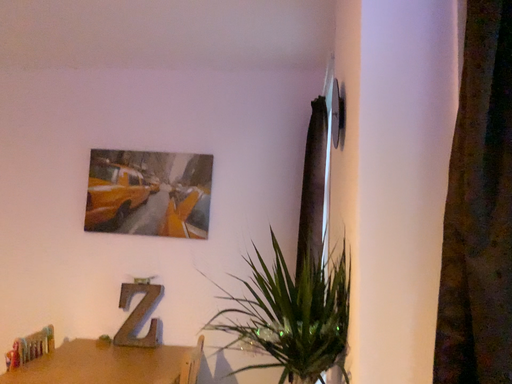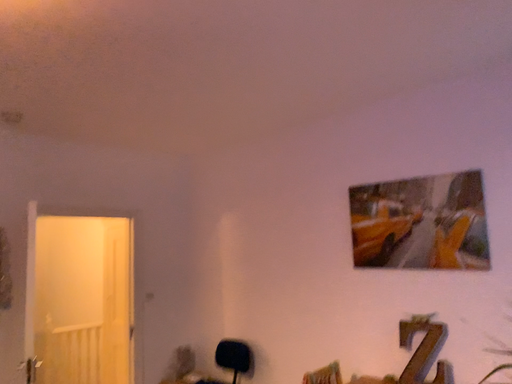
Question: How did the camera likely rotate when shooting the video?

Choices:
 (A) rotated right
 (B) rotated left

Answer: (B)